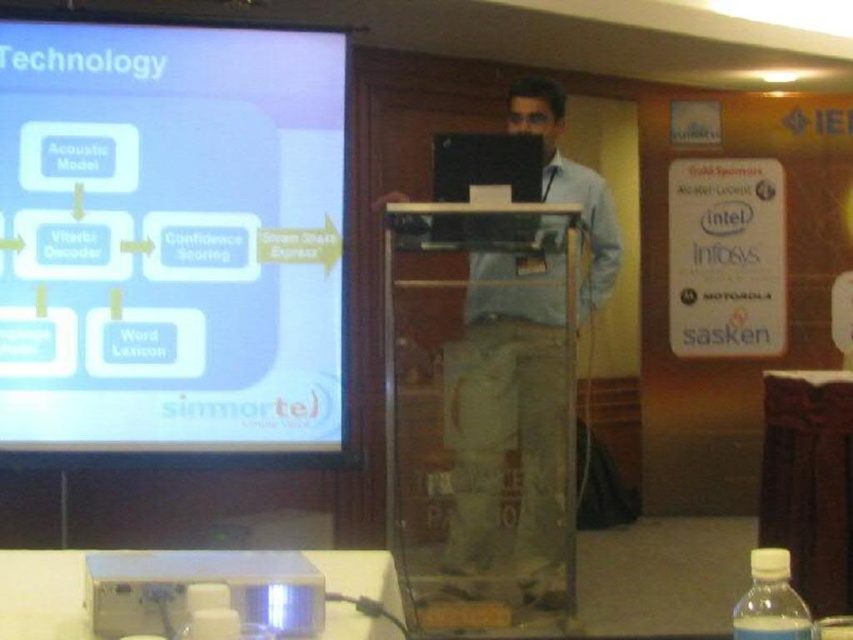
Question: Is matte black laptop at center above white plastic projector at lower left?

Choices:
 (A) no
 (B) yes

Answer: (B)

Question: Among these objects, which one is nearest to the camera?

Choices:
 (A) white glossy projector screen at upper left
 (B) matte black laptop at center
 (C) white plastic projector at lower left
 (D) clear plastic bottle at lower right

Answer: (D)

Question: Considering the relative positions of white glossy projector screen at upper left and matte black laptop at center in the image provided, where is white glossy projector screen at upper left located with respect to matte black laptop at center?

Choices:
 (A) below
 (B) above

Answer: (B)

Question: Which point appears farthest from the camera in this image?

Choices:
 (A) (517, 305)
 (B) (799, 628)
 (C) (231, 428)

Answer: (A)

Question: Estimate the real-world distances between objects in this image. Which object is farther from the white plastic projector at lower left?

Choices:
 (A) white glossy projector screen at upper left
 (B) clear plastic bottle at lower right

Answer: (A)

Question: Is matte black laptop at center in front of white plastic projector at lower left?

Choices:
 (A) yes
 (B) no

Answer: (B)